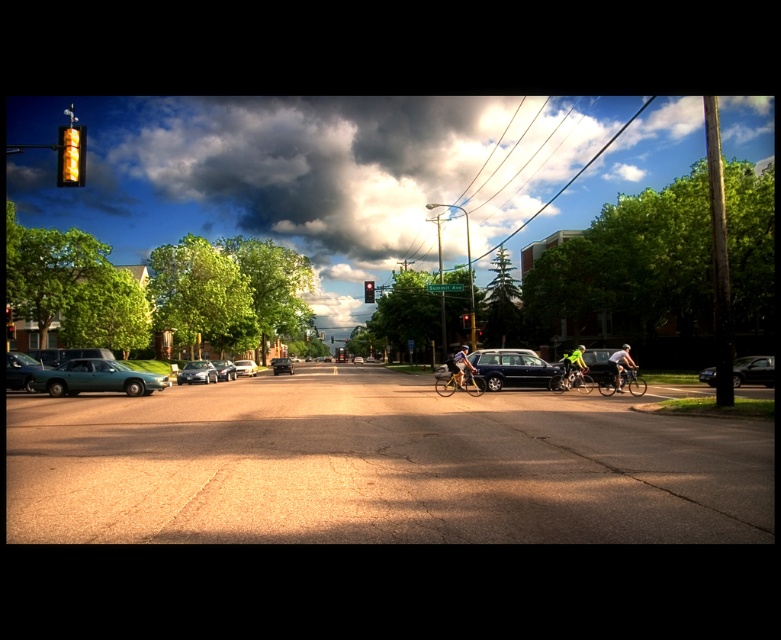
Question: Which object appears closest to the camera in this image?

Choices:
 (A) shiny silver bicycle at right
 (B) shiny metallic bicycle at center-right
 (C) neon green jersey at center

Answer: (A)

Question: Does matte black car at center appear on the left side of green fabric cyclist at center?

Choices:
 (A) yes
 (B) no

Answer: (B)

Question: Is yellow plastic traffic light at upper left thinner than green fabric cyclist at center?

Choices:
 (A) no
 (B) yes

Answer: (A)

Question: Is matte black car at center behind shiny black sedan at right?

Choices:
 (A) yes
 (B) no

Answer: (A)

Question: Which point appears farthest from the camera in this image?

Choices:
 (A) (27, 355)
 (B) (565, 381)
 (C) (280, 364)

Answer: (C)

Question: Which is nearer to the cloudy sky at upper center?

Choices:
 (A) silver metallic sedan at center
 (B) green fabric cyclist at center
 (C) amber glass traffic light at upper left

Answer: (A)